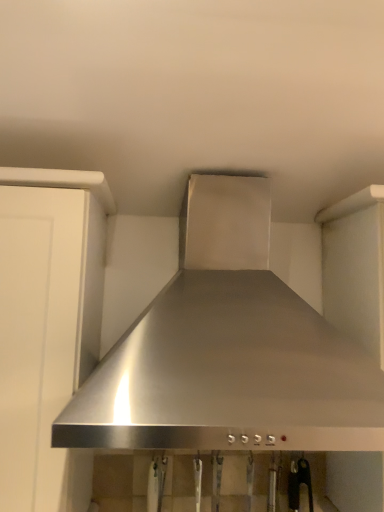
Question: Is white matte cabinet at left at the right side of stainless steel range hood at center?

Choices:
 (A) no
 (B) yes

Answer: (A)

Question: Is stainless steel range hood at center surrounded by white matte cabinet at left?

Choices:
 (A) no
 (B) yes

Answer: (A)

Question: Can you confirm if white matte cabinet at left is taller than stainless steel range hood at center?

Choices:
 (A) no
 (B) yes

Answer: (B)

Question: From a real-world perspective, is white matte cabinet at left over stainless steel range hood at center?

Choices:
 (A) yes
 (B) no

Answer: (B)

Question: Is white matte cabinet at left turned away from stainless steel range hood at center?

Choices:
 (A) yes
 (B) no

Answer: (B)

Question: Is white matte cabinet at left facing towards stainless steel range hood at center?

Choices:
 (A) no
 (B) yes

Answer: (A)

Question: From a real-world perspective, is stainless steel range hood at center on top of white matte cabinet at left?

Choices:
 (A) no
 (B) yes

Answer: (B)

Question: Considering the relative positions of stainless steel range hood at center and white matte cabinet at left in the image provided, is stainless steel range hood at center behind white matte cabinet at left?

Choices:
 (A) yes
 (B) no

Answer: (B)

Question: Is white matte cabinet at left a part of stainless steel range hood at center?

Choices:
 (A) yes
 (B) no

Answer: (B)

Question: Is stainless steel range hood at center smaller than white matte cabinet at left?

Choices:
 (A) yes
 (B) no

Answer: (B)

Question: Is stainless steel range hood at center taller than white matte cabinet at left?

Choices:
 (A) yes
 (B) no

Answer: (B)

Question: Is stainless steel range hood at center positioned in front of white matte cabinet at left?

Choices:
 (A) no
 (B) yes

Answer: (B)

Question: Would you say white matte cabinet at left is inside or outside stainless steel range hood at center?

Choices:
 (A) outside
 (B) inside

Answer: (A)